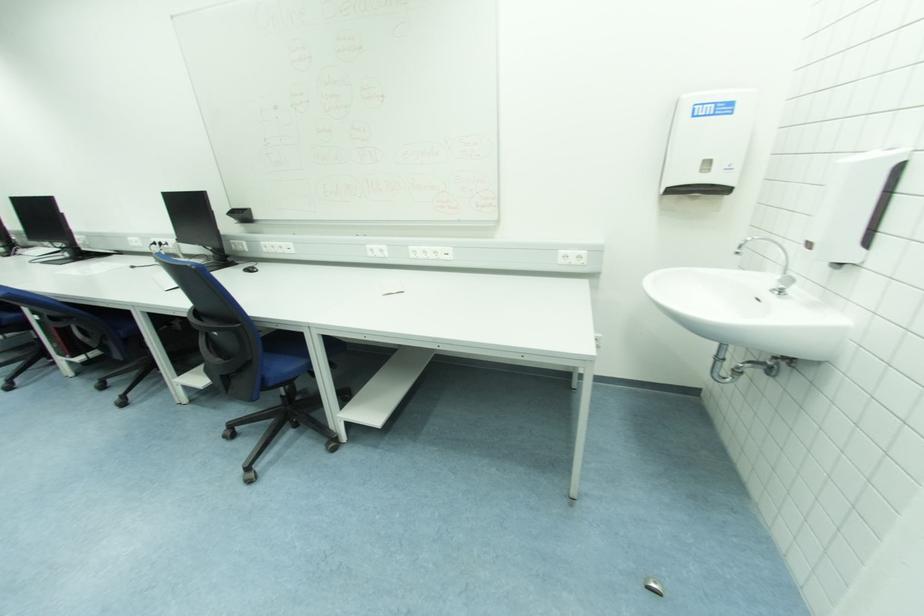
Locate an element on the screen. The width and height of the screenshot is (924, 616). faucet handle is located at coordinates (783, 284).